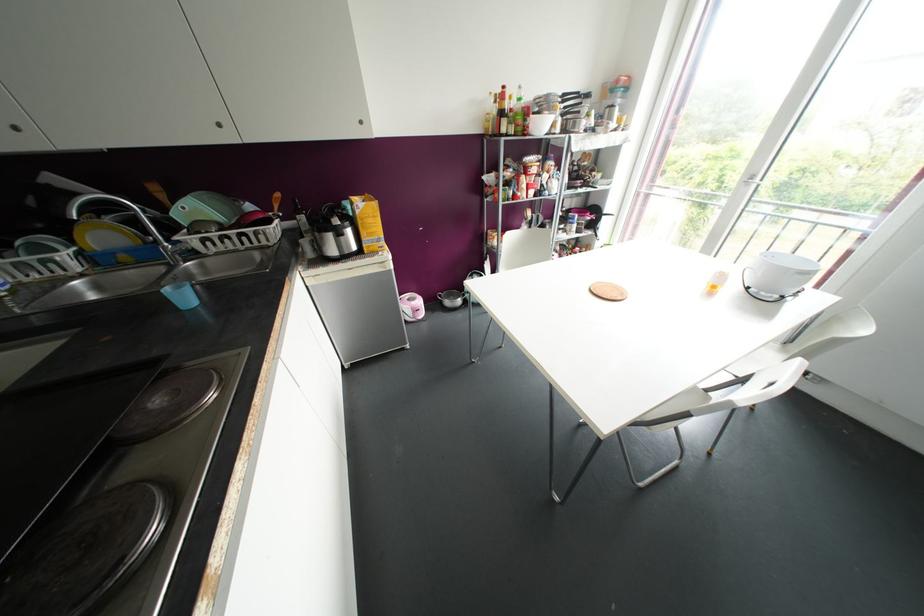
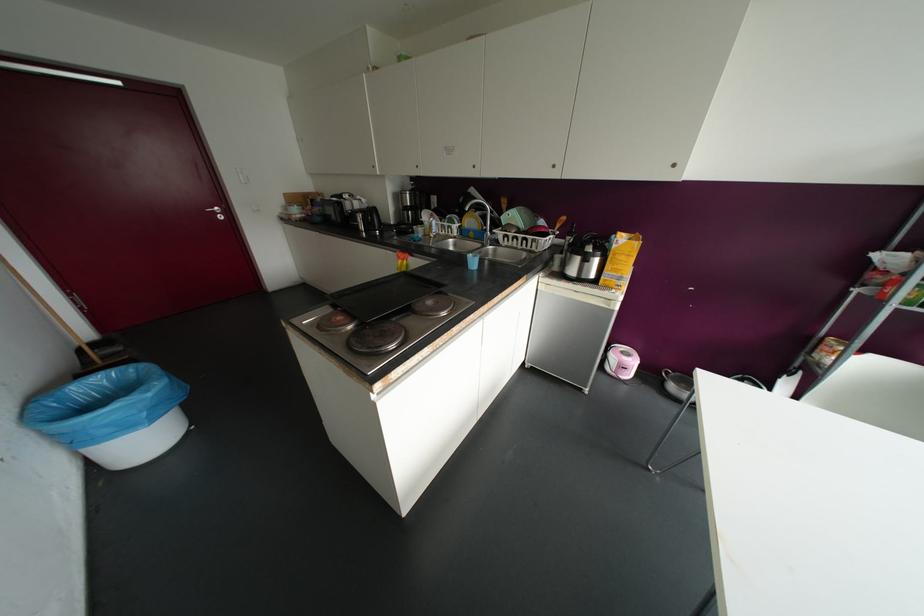
The point at (166, 238) is marked in the first image. Where is the corresponding point in the second image?

(490, 230)